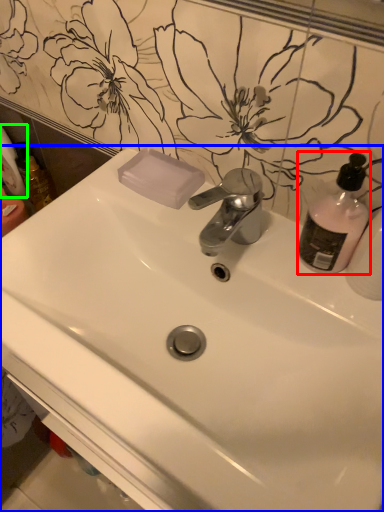
Question: Based on their relative distances, which object is farther from cleaning product (highlighted by a red box)? Choose from sink (highlighted by a blue box) and toilet paper (highlighted by a green box).

Choices:
 (A) sink
 (B) toilet paper

Answer: (B)